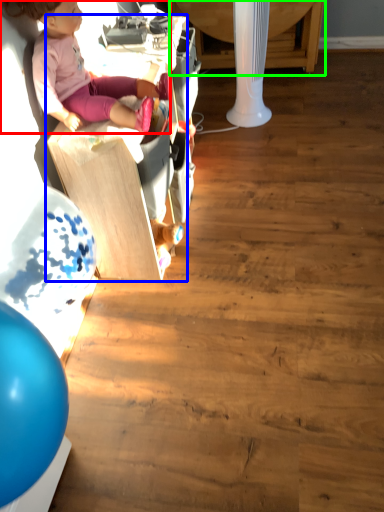
Question: Estimate the real-world distances between objects in this image. Which object is farther from person (highlighted by a red box), furniture (highlighted by a blue box) or table (highlighted by a green box)?

Choices:
 (A) furniture
 (B) table

Answer: (B)